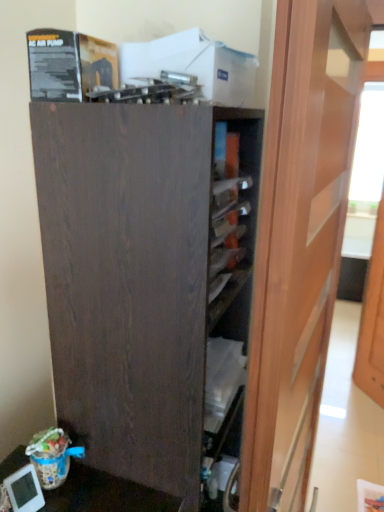
Find the location of a particular element. The height and width of the screenshot is (512, 384). vacant area that is in front of wooden door at right, which is counted as the 1th door, starting from the right is located at coordinates (367, 416).